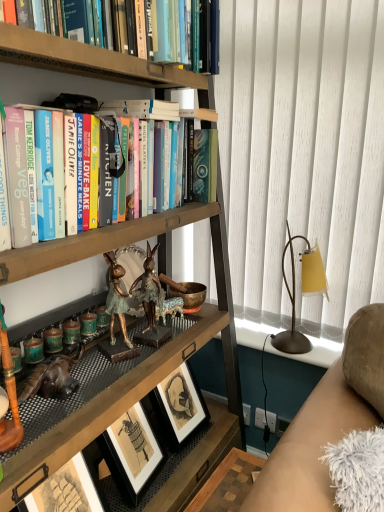
Question: Is suede-like beige couch at lower right shorter than matte gold table lamp at right?

Choices:
 (A) yes
 (B) no

Answer: (B)

Question: From a real-world perspective, is suede-like beige couch at lower right over matte gold table lamp at right?

Choices:
 (A) yes
 (B) no

Answer: (B)

Question: Is suede-like beige couch at lower right smaller than matte gold table lamp at right?

Choices:
 (A) yes
 (B) no

Answer: (B)

Question: Is suede-like beige couch at lower right with matte gold table lamp at right?

Choices:
 (A) yes
 (B) no

Answer: (B)

Question: Is the position of suede-like beige couch at lower right more distant than that of matte gold table lamp at right?

Choices:
 (A) yes
 (B) no

Answer: (B)

Question: Does point (192, 220) appear closer or farther from the camera than point (228, 387)?

Choices:
 (A) farther
 (B) closer

Answer: (B)

Question: Is hardcover books at upper left taller or shorter than wooden bookshelf at center?

Choices:
 (A) tall
 (B) short

Answer: (B)

Question: In terms of size, does hardcover books at upper left appear bigger or smaller than wooden bookshelf at center?

Choices:
 (A) big
 (B) small

Answer: (B)

Question: From a real-world perspective, is hardcover books at upper left positioned above or below wooden bookshelf at center?

Choices:
 (A) below
 (B) above

Answer: (B)

Question: Does point (124, 306) appear closer or farther from the camera than point (38, 443)?

Choices:
 (A) closer
 (B) farther

Answer: (B)

Question: Looking at the image, does gold metallic rabbit at center seem bigger or smaller compared to wooden bookshelf at center?

Choices:
 (A) small
 (B) big

Answer: (A)

Question: From a real-world perspective, is gold metallic rabbit at center positioned above or below wooden bookshelf at center?

Choices:
 (A) above
 (B) below

Answer: (A)

Question: Relative to wooden bookshelf at center, is gold metallic rabbit at center in front or behind?

Choices:
 (A) front
 (B) behind

Answer: (B)

Question: Looking at their shapes, would you say matte gold table lamp at right is wider or thinner than white fabric curtain at right?

Choices:
 (A) thin
 (B) wide

Answer: (B)

Question: Considering the positions of matte gold table lamp at right and white fabric curtain at right in the image, is matte gold table lamp at right taller or shorter than white fabric curtain at right?

Choices:
 (A) short
 (B) tall

Answer: (A)